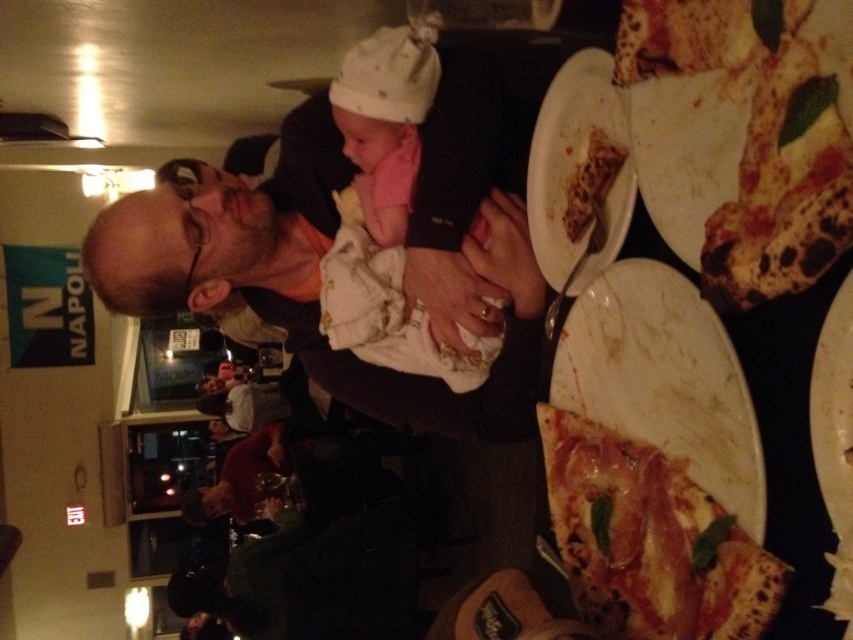
Between golden brown crusty pizza at right and golden crispy pizza slice at upper right, which one is positioned higher?

golden brown crusty pizza at right is higher up.

Which is behind, point (815, 120) or point (581, 205)?

Positioned behind is point (581, 205).

This screenshot has height=640, width=853. Identify the location of golden brown crusty pizza at right. click(x=743, y=136).

Who is more distant from viewer, (585,74) or (606,147)?

Positioned behind is point (585,74).

What do you see at coordinates (579, 173) in the screenshot?
I see `white marble plate at upper right` at bounding box center [579, 173].

Between point (561, 292) and point (596, 172), which one is positioned in front?

Point (596, 172)

Identify the location of white marble plate at upper right. The image size is (853, 640). 579,173.

Can you confirm if matte black shirt at center is positioned above white soft fabric baby at center?

No, matte black shirt at center is not above white soft fabric baby at center.

The width and height of the screenshot is (853, 640). In order to click on matte black shirt at center in this screenshot , I will do `click(316, 289)`.

Locate an element on the screen. matte black shirt at center is located at coordinates [x=316, y=289].